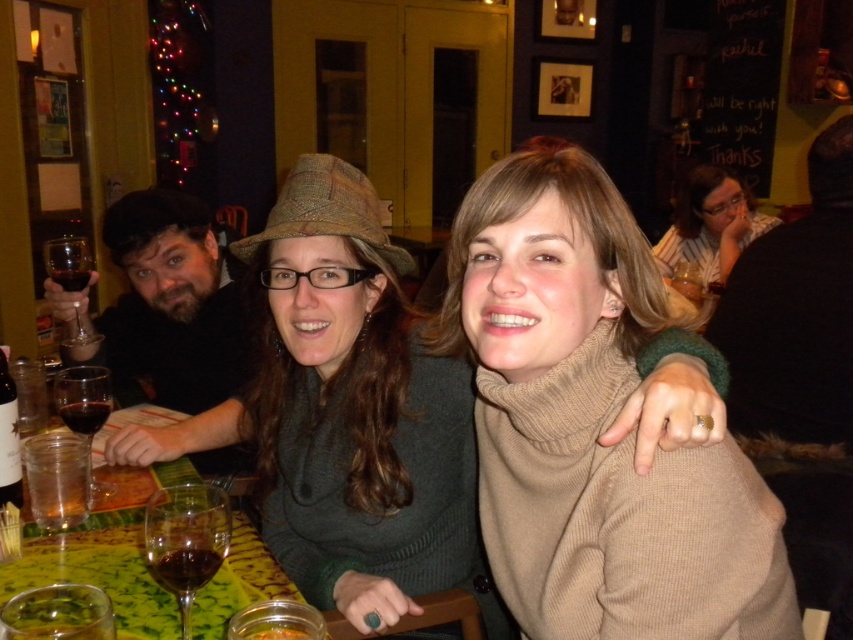
You are a waiter at this restaurant and need to deliver a dessert menu to the guests. The dessert menu is currently on the table behind the knitted green sweater at center. To reach the dessert menu, you must pass between the guests and the table. However, there is a translucent glass wine at lower left in your path. Is the wine glass in your way?

The translucent glass wine at lower left is behind the knitted green sweater at center, so it is not in your path. You can safely reach the dessert menu without disturbing the wine glass.

You are a waiter at this restaurant and need to place a dessert plate between the translucent glass wine glass at lower left and the transparent glass at left. The plate is 12 inches wide. Will there be enough space?

The distance between the translucent glass wine glass at lower left and the transparent glass at left is 31.92 inches. Since the plate is only 12 inches wide, there is sufficient space to place it between them.